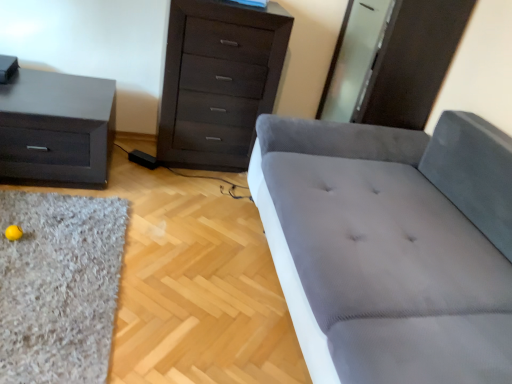
The height and width of the screenshot is (384, 512). In order to click on free point above matte black nightstand at left (from a real-world perspective) in this screenshot , I will do `click(53, 82)`.